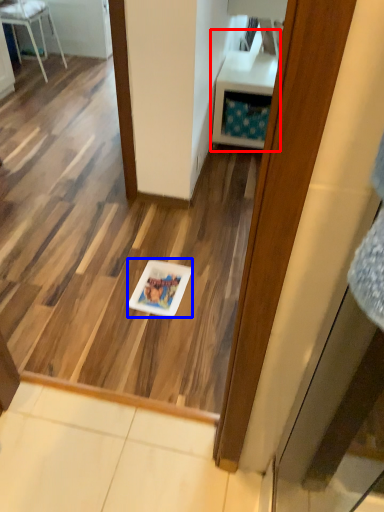
Question: Among these objects, which one is nearest to the camera, vanity (highlighted by a red box) or glass plate (highlighted by a blue box)?

Choices:
 (A) vanity
 (B) glass plate

Answer: (B)